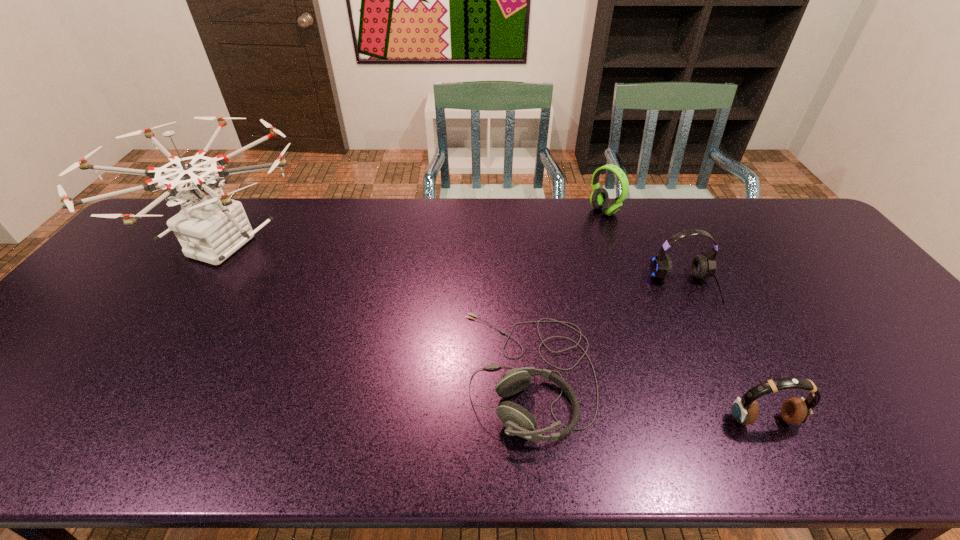
Where is `free space between the third headset from right to left and the tallest object`? free space between the third headset from right to left and the tallest object is located at coordinates (414, 228).

Locate an element on the screen. This screenshot has height=540, width=960. vacant space that's between the tallest object and the shortest object is located at coordinates (376, 310).

The image size is (960, 540). Identify the location of free space between the leftmost headset and the tallest object. (376, 310).

This screenshot has height=540, width=960. I want to click on vacant area between the second farthest headset and the drone, so (x=454, y=267).

Locate an element on the screen. Image resolution: width=960 pixels, height=540 pixels. empty location between the second farthest headset and the leftmost object is located at coordinates (454, 267).

Identify the location of vacant area between the farthest headset and the shortest headset. (566, 292).

Find the location of a particular element. The image size is (960, 540). free space between the drone and the second farthest headset is located at coordinates (454, 267).

The image size is (960, 540). In order to click on object that is the closest one to the leftmost headset in this screenshot , I will do `click(703, 266)`.

The image size is (960, 540). What are the coordinates of `the second closest object to the leftmost object` in the screenshot? It's located at point(599,198).

Find the location of a particular element. The image size is (960, 540). headset that can be found as the third closest to the third nearest headset is located at coordinates (794, 411).